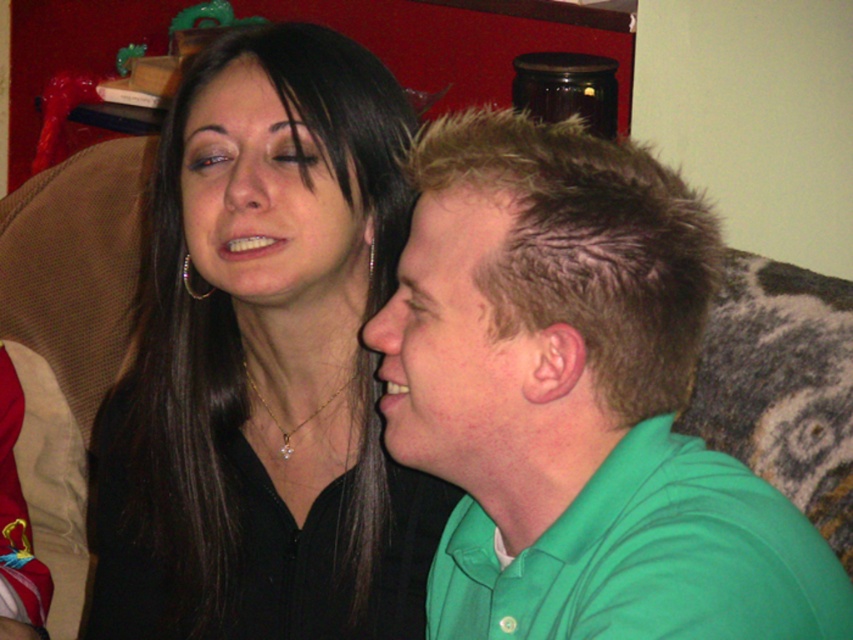
Who is taller, black matte hair at upper left or silver metallic hoop at upper left?

black matte hair at upper left

Is point (378, 604) closer to camera compared to point (201, 294)?

Yes, point (378, 604) is in front of point (201, 294).

Who is more distant from viewer, [343,317] or [184,260]?

Point [184,260]

Identify the location of black matte hair at upper left. The height and width of the screenshot is (640, 853). (264, 364).

From the picture: Is green cotton shirt at center above silver metallic hoop at upper left?

No.

Between point (700, 518) and point (189, 260), which one is positioned in front?

Point (700, 518) is in front.

Where is `green cotton shirt at center`? green cotton shirt at center is located at coordinates (577, 403).

Can you confirm if green matte shirt at right is smaller than matte black face at upper left?

Indeed, green matte shirt at right has a smaller size compared to matte black face at upper left.

Is green matte shirt at right closer to camera compared to matte black face at upper left?

Yes, green matte shirt at right is closer to the viewer.

Is point (445, 241) closer to camera compared to point (329, 170)?

That is True.

This screenshot has height=640, width=853. I want to click on green matte shirt at right, so click(x=451, y=344).